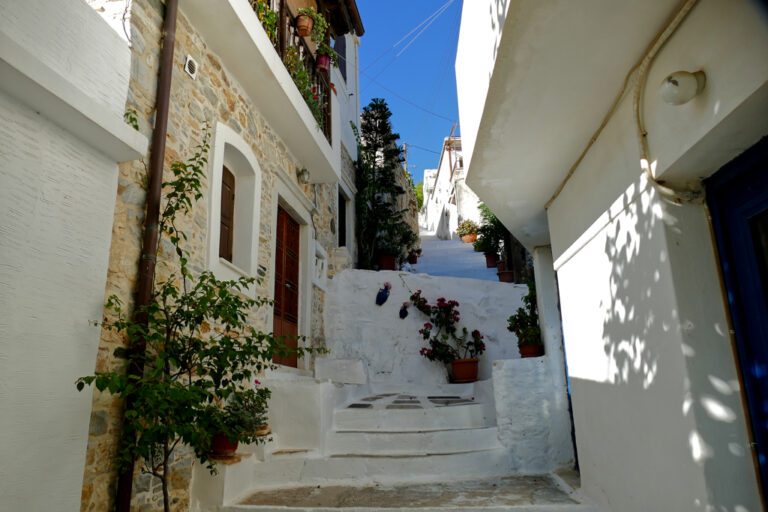
At what (x,y) coordinates should I click in order to perform the action: click on potted plant. Please return your answer as a coordinate pair (x, y). Looking at the image, I should click on (468, 354).